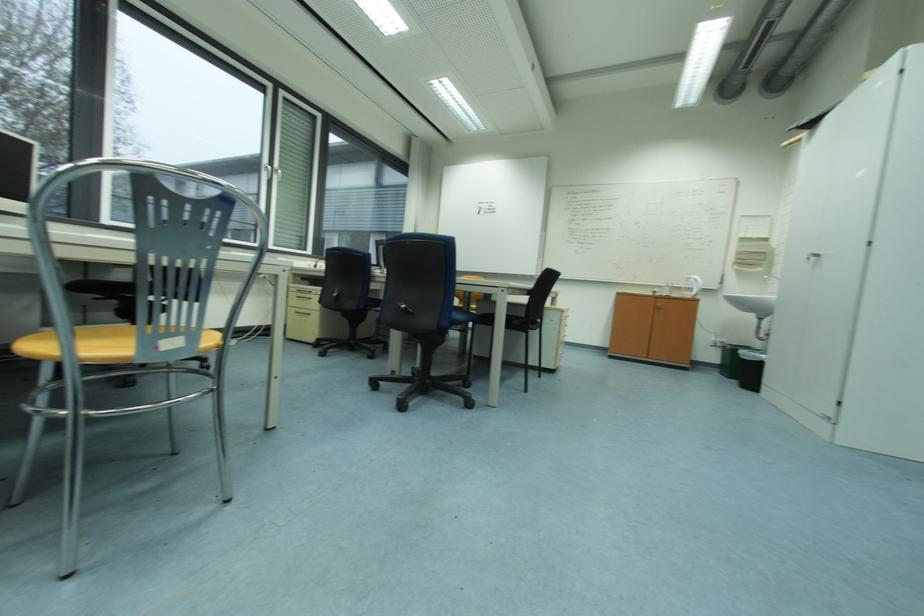
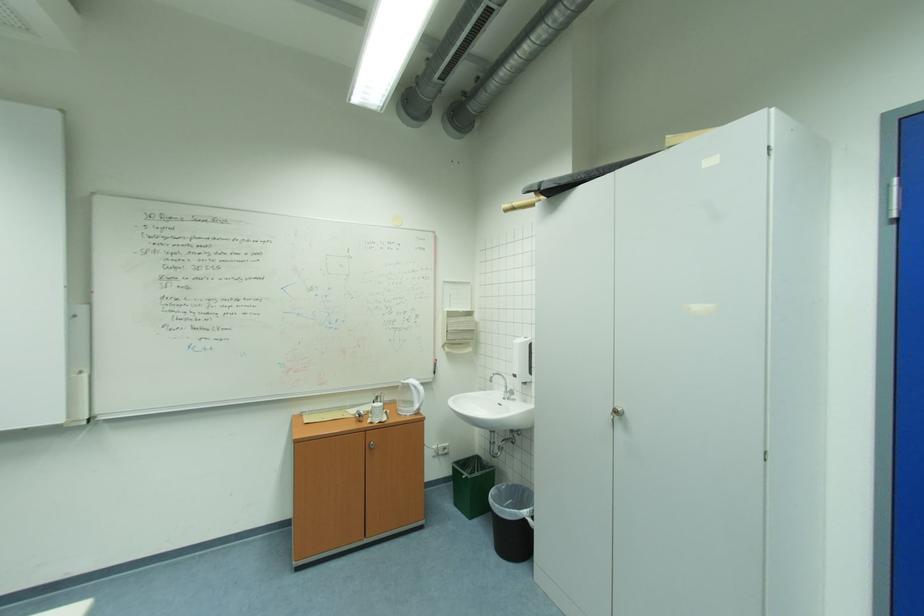
In the second image, find the point that corresponds to (x=772, y=358) in the first image.

(532, 513)